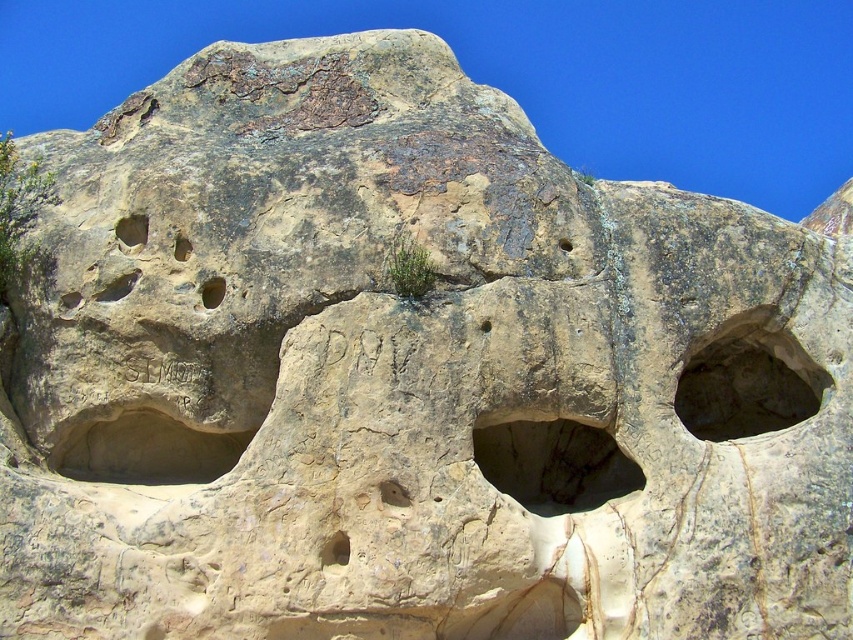
You are standing in front of the rock formation described in the scene. There is a point labeled as point [148,451]. Based on the description, where on the rock would this point be located?

The point [148,451] corresponds to the smooth beige rock at lower left.

From the picture: You are a geologist examining the rock formation. You need to locate the yellow rock hole at center for further analysis. What are its coordinates?

The yellow rock hole at center is located at coordinates point (x=212, y=291).

You are an archaeologist examining the scene. You need to determine which object is taller between the smooth beige rock at lower left and the yellow rock hole at center. Based on the scene, can you identify which one is taller?

The smooth beige rock at lower left has a greater height compared to the yellow rock hole at center, so the smooth beige rock at lower left is taller.